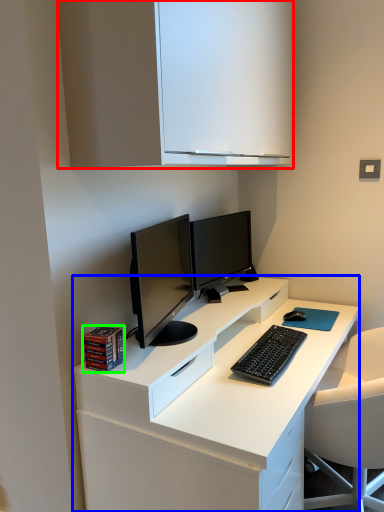
Question: Estimate the real-world distances between objects in this image. Which object is farther from cabinetry (highlighted by a red box), desk (highlighted by a blue box) or book (highlighted by a green box)?

Choices:
 (A) desk
 (B) book

Answer: (A)